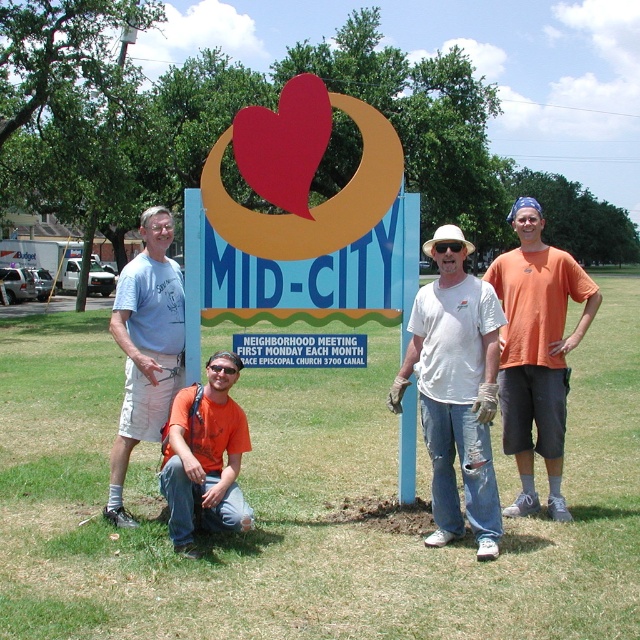
Which is in front, point (525, 364) or point (125, 356)?

Point (525, 364) is more forward.

How far apart are orange cotton shirt at right and matte blue shirt at left?

2.85 meters

You are a GUI agent. You are given a task and a screenshot of the screen. Output one action in this format:
    pyautogui.click(x=<x>, y=<y>)
    Task: Click on the orange cotton shirt at right
    The width and height of the screenshot is (640, 640).
    Given the screenshot: What is the action you would take?
    pyautogui.click(x=536, y=352)

Is white cotton shirt at center further to the viewer compared to matte blue shirt at left?

No, white cotton shirt at center is closer to the viewer.

Does white cotton shirt at center come in front of matte blue shirt at left?

Yes, it is.

Is point (436, 353) behind point (173, 374)?

No.

In order to click on white cotton shirt at center in this screenshot , I will do `click(456, 388)`.

Based on the photo, who is lower down, orange cotton shirt at right or orange t-shirt at center?

orange t-shirt at center is lower down.

Between point (525, 369) and point (200, 440), which one is positioned behind?

The point (525, 369) is more distant.

Who is more distant from viewer, (x=529, y=477) or (x=236, y=413)?

The point (x=529, y=477) is behind.

This screenshot has width=640, height=640. In order to click on orange cotton shirt at right in this screenshot , I will do `click(536, 352)`.